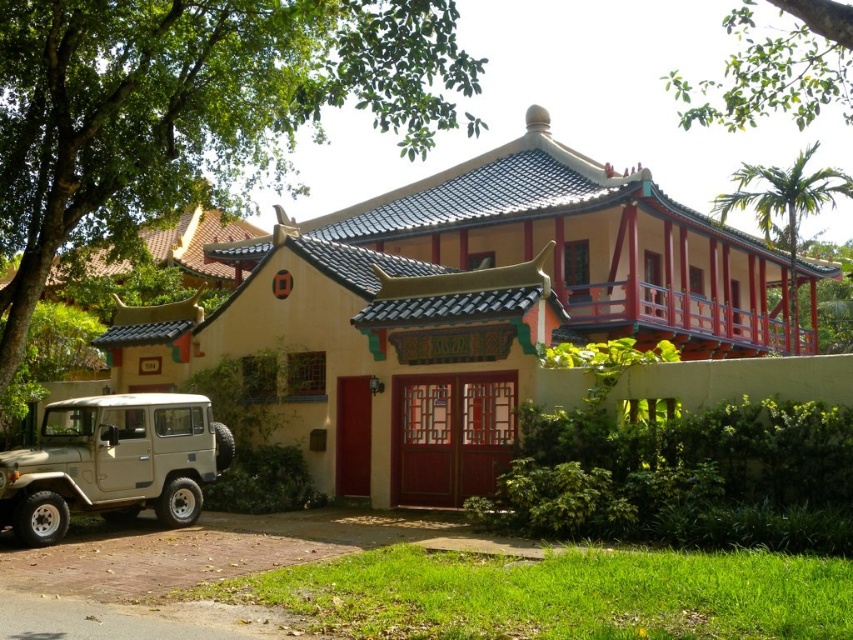
You are standing in front of the traditional building and want to know the position of the green leafy tree at upper left relative to the building. Can you determine if it is to the left or right side of the building?

The green leafy tree at upper left is located at point (189, 109), which places it on the left side of the building relative to the observer standing in front.

You are an architect designing a new garden layout. The green leafy tree at upper left is located at coordinates point 0.172, 0.223. If you want to place a new bench exactly 0.05 units to the right of the tree, what would be the new coordinates for the bench?

The new coordinates for the bench would be point (x=189, y=141) since you add 0.05 to the x coordinate of the green leafy tree at upper left.